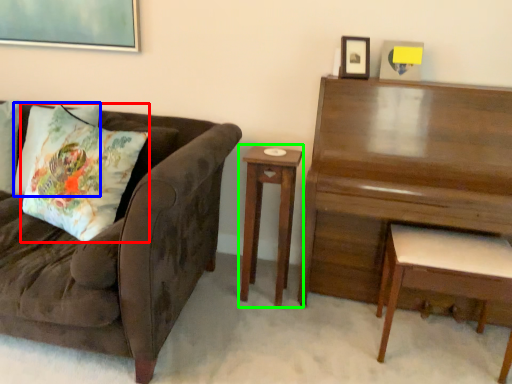
Question: Based on their relative distances, which object is farther from throw pillow (highlighted by a red box)? Choose from pillow (highlighted by a blue box) and nightstand (highlighted by a green box).

Choices:
 (A) pillow
 (B) nightstand

Answer: (B)